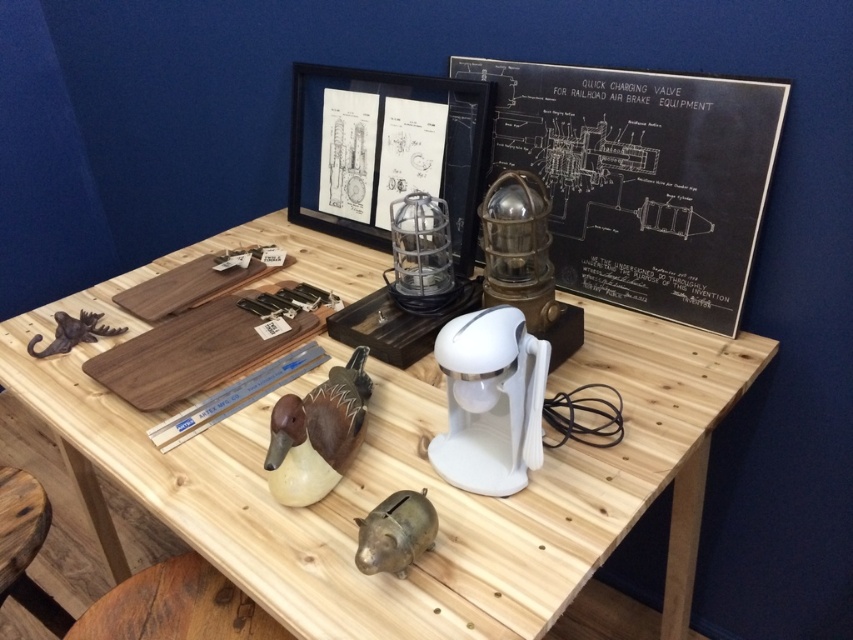
Consider the image. You are organizing a small event and need to hang a decorative banner. The banner is 1.2 meters wide. You have two options to hang it from either the blackboard at upper right or the brown matte hook at left. Based on the scene description, which object can support the banner without it being wider than the object itself?

The blackboard at upper right can support the banner without it being wider than the object itself because it might be wider than the brown matte hook at left according to the description.

You are organizing the desk and need to place a new item between the brown matte hook at left and the black paperboard at center. Where should you position it to ensure it is in front of the hook but behind the paperboard?

Place the new item between the brown matte hook at left and the black paperboard at center so that it is in front of the hook but behind the paperboard. Since the brown matte hook at left is behind the black paperboard at center, positioning the item in this space will satisfy both conditions.

You are organizing a display on the desk and need to place a decorative item between the brown matte duck at center and the brass piggy bank at center. Which item should you place closer to the edge of the desk to ensure it doesn

The brown matte duck at center has a larger width than the brass piggy bank at center, so placing the decorative item closer to the edge near the brass piggy bank at center would leave enough space between the two items.